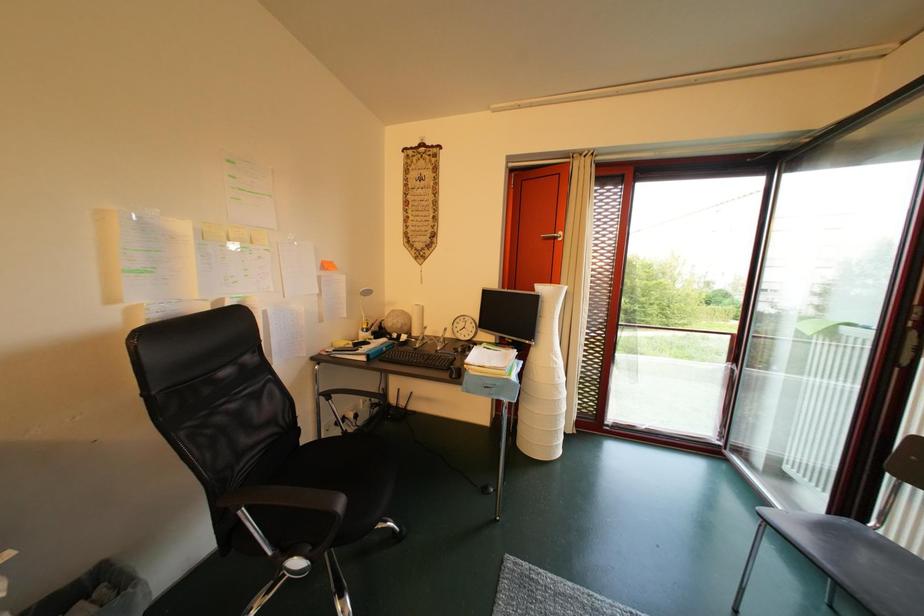
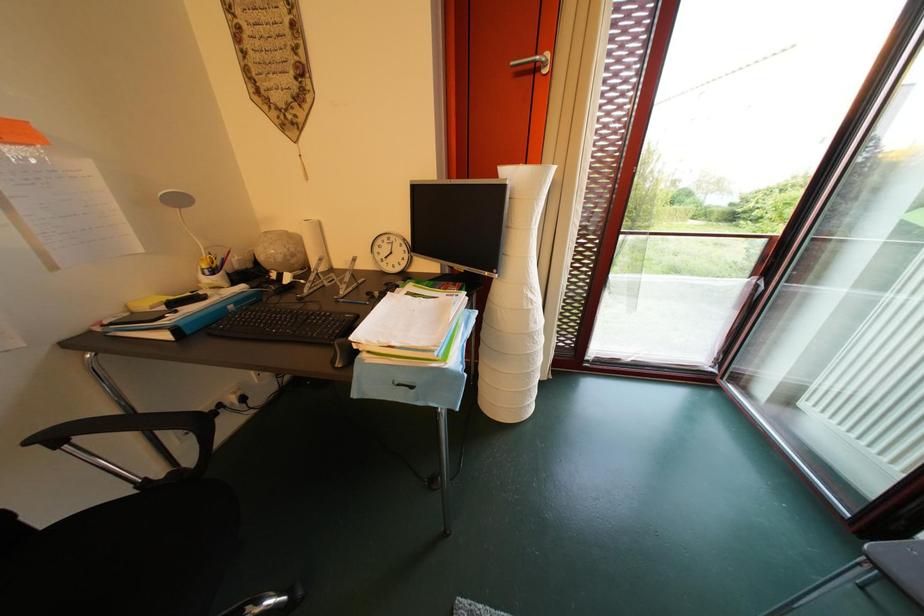
Question: The images are taken continuously from a first-person perspective. In which direction are you moving?

Choices:
 (A) Left
 (B) Right
 (C) Forward
 (D) Backward

Answer: (C)